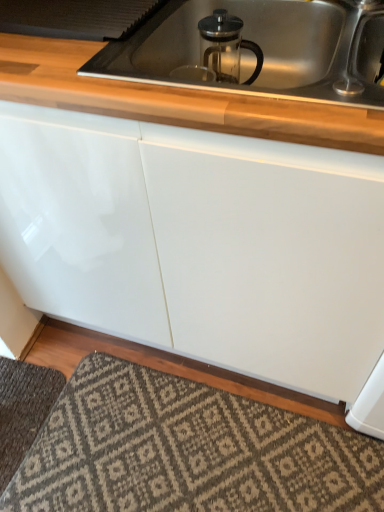
Find the location of a particular element. The height and width of the screenshot is (512, 384). vacant space underneath patterned carpet at lower center, placed as the 1th doormat when sorted from right to left (from a real-world perspective) is located at coordinates (190, 453).